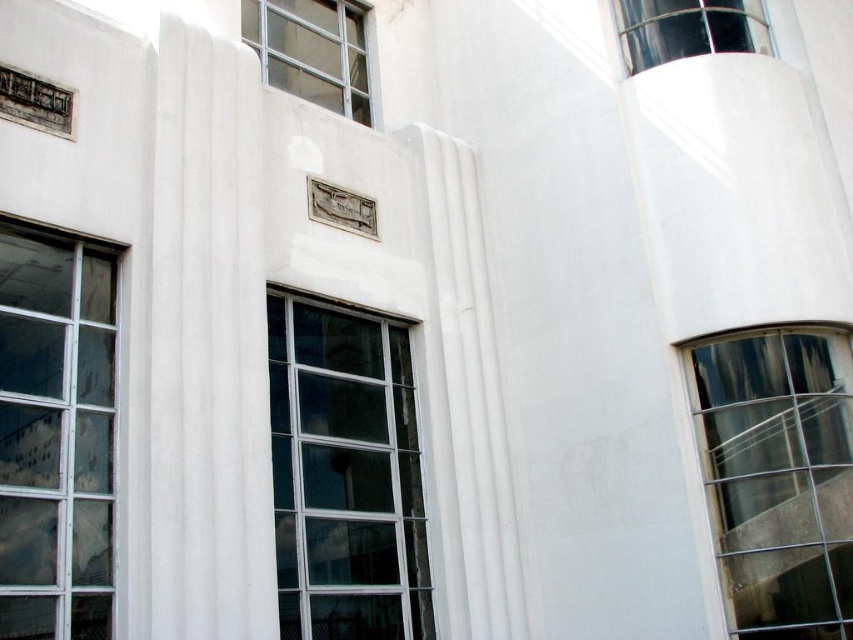
Question: Which object appears closest to the camera in this image?

Choices:
 (A) clear glass window at upper center
 (B) clear glass window at right

Answer: (B)

Question: Where is clear glass window at upper center located in relation to transparent glass window at upper right in the image?

Choices:
 (A) above
 (B) below

Answer: (B)

Question: Which object is the closest to the clear glass window at right?

Choices:
 (A) clear glass window at center
 (B) clear glass window at left

Answer: (A)

Question: In this image, where is clear glass window at upper center located relative to transparent glass window at upper right?

Choices:
 (A) above
 (B) below

Answer: (B)

Question: Among these points, which one is nearest to the camera?

Choices:
 (A) (747, 628)
 (B) (212, 49)
 (C) (693, 13)
 (D) (94, 573)

Answer: (D)

Question: Does clear glass window at center come in front of clear glass window at upper center?

Choices:
 (A) no
 (B) yes

Answer: (B)